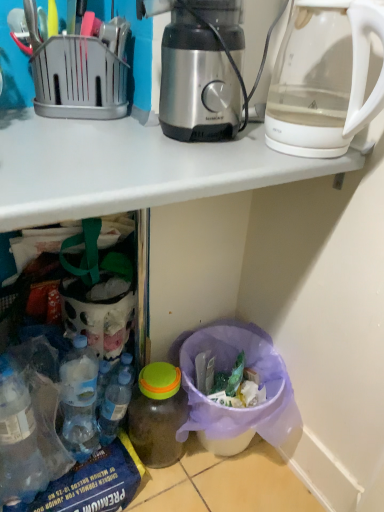
Locate an element on the screen. This screenshot has width=384, height=512. vacant area that lies in front of stainless steel coffee maker at center is located at coordinates (174, 163).